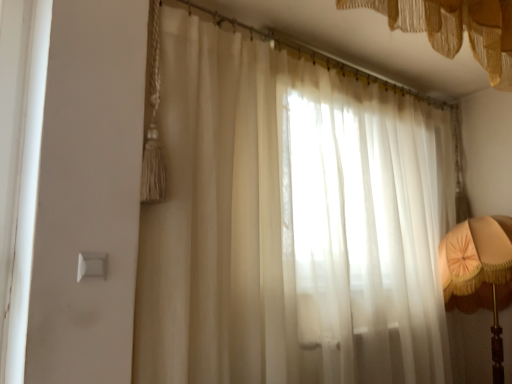
Question: Can you confirm if matte orange fabric lampshade at right is positioned to the left of sheer white curtain at center, which appears as the 2th curtain when viewed from the top?

Choices:
 (A) no
 (B) yes

Answer: (A)

Question: Considering the relative sizes of matte orange fabric lampshade at right and sheer white curtain at center, which appears as the 2th curtain when viewed from the top, in the image provided, is matte orange fabric lampshade at right thinner than sheer white curtain at center, which appears as the 2th curtain when viewed from the top,?

Choices:
 (A) yes
 (B) no

Answer: (B)

Question: Is matte orange fabric lampshade at right outside sheer white curtain at center, the 1th curtain from the bottom?

Choices:
 (A) no
 (B) yes

Answer: (A)

Question: Could you tell me if matte orange fabric lampshade at right is turned towards sheer white curtain at center, which appears as the 2th curtain when viewed from the top?

Choices:
 (A) no
 (B) yes

Answer: (B)

Question: Considering the relative sizes of matte orange fabric lampshade at right and sheer white curtain at center, which appears as the 2th curtain when viewed from the top, in the image provided, is matte orange fabric lampshade at right wider than sheer white curtain at center, which appears as the 2th curtain when viewed from the top,?

Choices:
 (A) no
 (B) yes

Answer: (B)

Question: Considering the positions of matte orange fabric lampshade at right and translucent fabric curtain at upper center, the 1th curtain positioned from the top, in the image, is matte orange fabric lampshade at right taller or shorter than translucent fabric curtain at upper center, the 1th curtain positioned from the top,?

Choices:
 (A) tall
 (B) short

Answer: (A)

Question: Based on their positions, is matte orange fabric lampshade at right located to the left or right of translucent fabric curtain at upper center, which is the 2th curtain from bottom to top?

Choices:
 (A) right
 (B) left

Answer: (A)

Question: From a real-world perspective, relative to translucent fabric curtain at upper center, the 1th curtain positioned from the top, is matte orange fabric lampshade at right vertically above or below?

Choices:
 (A) above
 (B) below

Answer: (B)

Question: Considering their positions, is matte orange fabric lampshade at right located in front of or behind translucent fabric curtain at upper center, which is the 2th curtain from bottom to top?

Choices:
 (A) front
 (B) behind

Answer: (B)

Question: In terms of width, does white plastic light switch at lower left look wider or thinner when compared to matte orange fabric lampshade at right?

Choices:
 (A) wide
 (B) thin

Answer: (B)

Question: In terms of height, does white plastic light switch at lower left look taller or shorter compared to matte orange fabric lampshade at right?

Choices:
 (A) tall
 (B) short

Answer: (B)

Question: Choose the correct answer: Is white plastic light switch at lower left inside matte orange fabric lampshade at right or outside it?

Choices:
 (A) outside
 (B) inside

Answer: (A)

Question: Considering the relative positions of white plastic light switch at lower left and matte orange fabric lampshade at right in the image provided, is white plastic light switch at lower left to the left or to the right of matte orange fabric lampshade at right?

Choices:
 (A) left
 (B) right

Answer: (A)

Question: Considering their positions, is matte orange fabric lampshade at right located in front of or behind white plastic light switch at lower left?

Choices:
 (A) front
 (B) behind

Answer: (B)

Question: In terms of height, does matte orange fabric lampshade at right look taller or shorter compared to white plastic light switch at lower left?

Choices:
 (A) tall
 (B) short

Answer: (A)